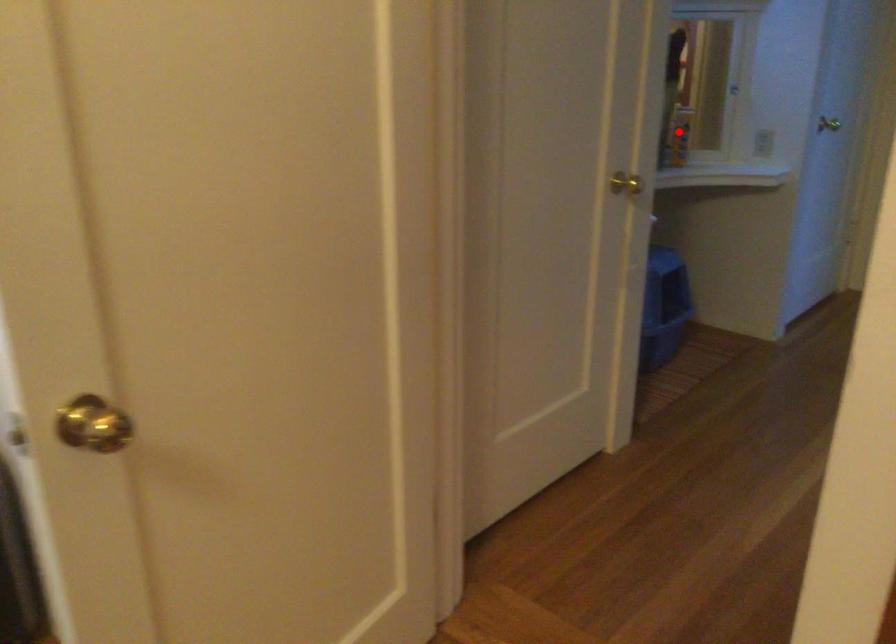
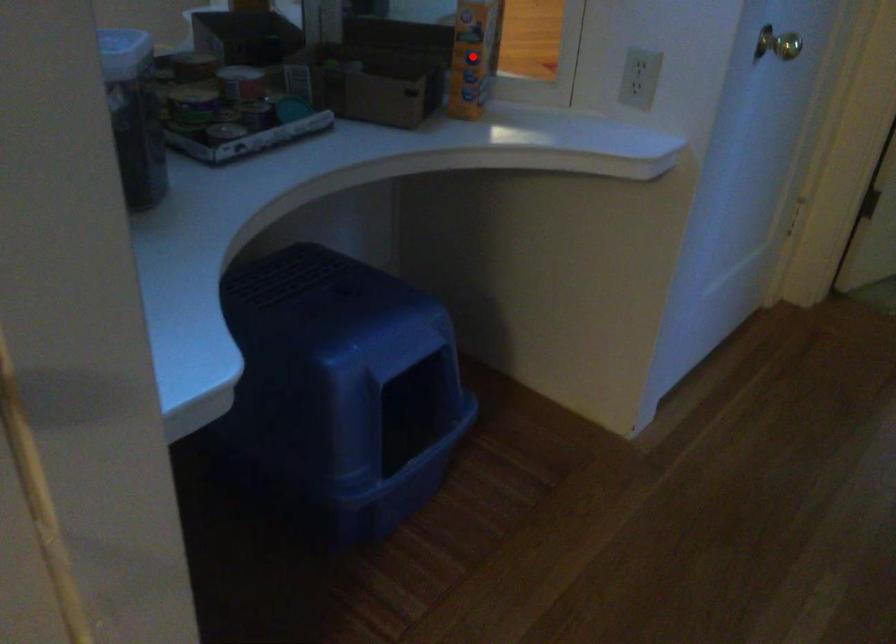
I am providing you with two images of the same scene from different viewpoints. A red point is marked on the first image and another point is marked on the second image. Is the red point in image1 aligned with the point shown in image2?

Yes